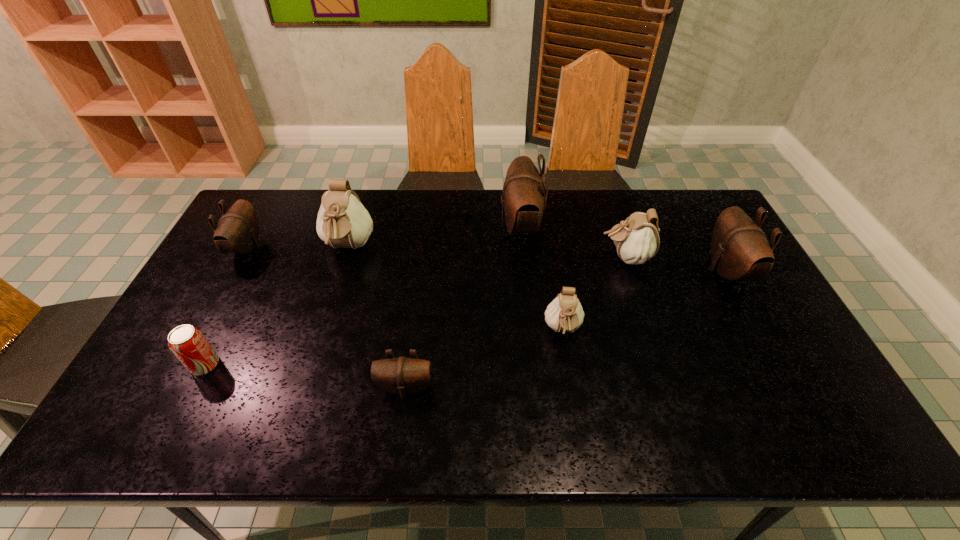
Identify the location of vacant space located 0.070m with the flap open on the rightmost object. (685, 271).

Find the location of a particular element. free spot located on the front-facing side of the second smallest white pouch is located at coordinates (504, 258).

Find the location of `free location located 0.220m on the front-facing side of the second smallest white pouch`. free location located 0.220m on the front-facing side of the second smallest white pouch is located at coordinates (530, 258).

The width and height of the screenshot is (960, 540). What are the coordinates of `free region located 0.220m on the front-facing side of the second smallest white pouch` in the screenshot? It's located at (530, 258).

You are a GUI agent. You are given a task and a screenshot of the screen. Output one action in this format:
    pyautogui.click(x=<x>, y=<y>)
    Task: Click on the vacant region located with the flap open on the third biggest brown pouch
    The height and width of the screenshot is (540, 960).
    Given the screenshot: What is the action you would take?
    pyautogui.click(x=299, y=248)

The height and width of the screenshot is (540, 960). Find the location of `blank area located 0.220m on the front-facing side of the third nearest object`. blank area located 0.220m on the front-facing side of the third nearest object is located at coordinates (579, 430).

Identify the location of blank space located on the right of the soda can. (322, 365).

Locate an element on the screen. vacant space located 0.080m with the flap open on the second brown pouch from left to right is located at coordinates (399, 433).

Identify the location of pouch that is at the left edge. The height and width of the screenshot is (540, 960). (237, 232).

Locate an element on the screen. soda can located at the left edge is located at coordinates point(189,345).